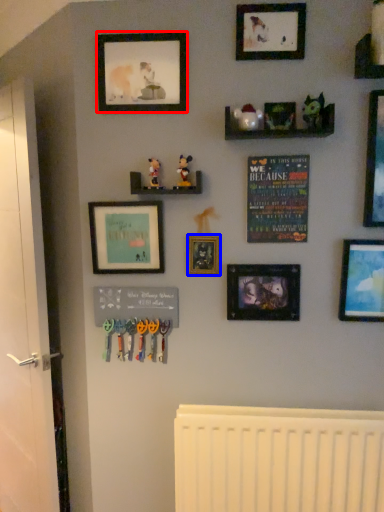
Question: Among these objects, which one is farthest to the camera, picture frame (highlighted by a red box) or picture frame (highlighted by a blue box)?

Choices:
 (A) picture frame
 (B) picture frame

Answer: (B)